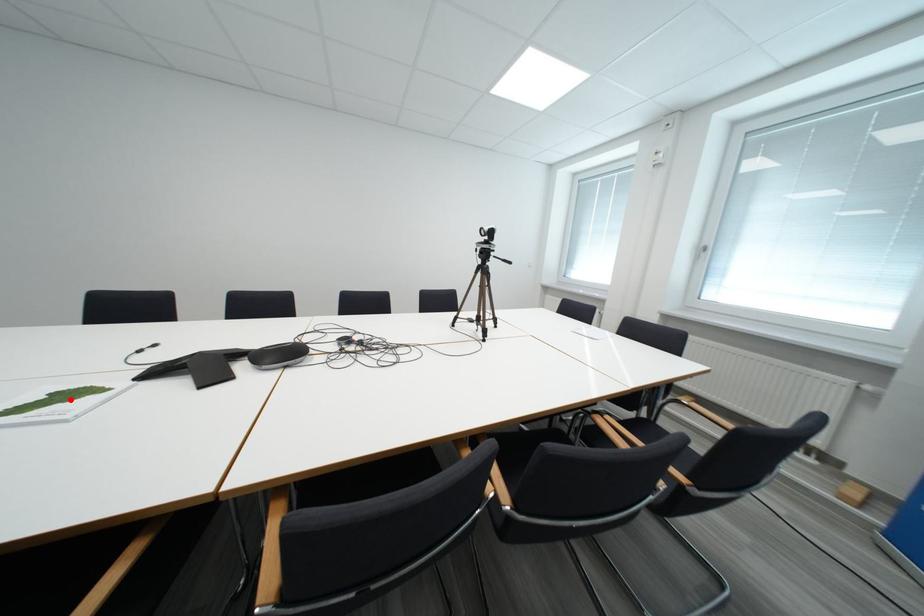
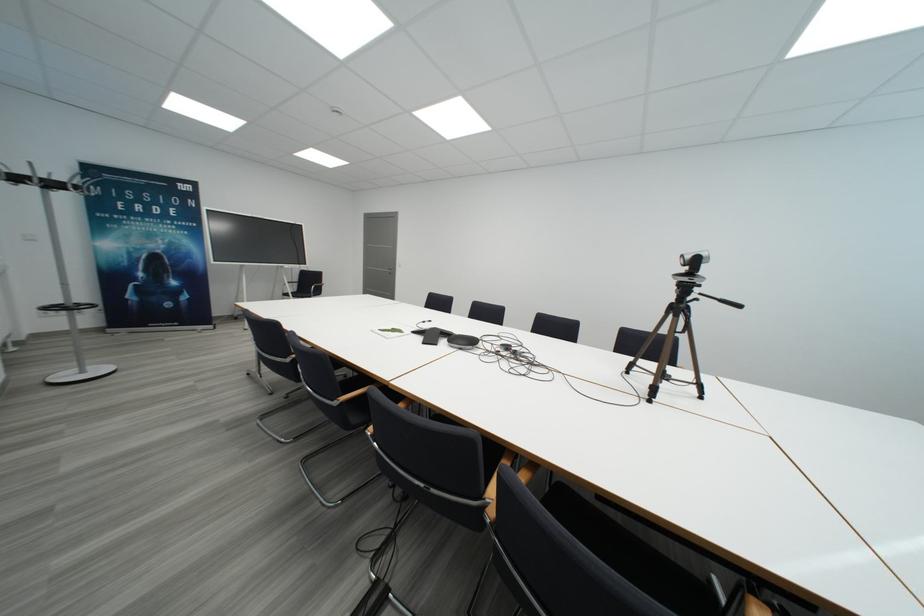
In the second image, find the point that corresponds to the highlighted location in the first image.

(400, 333)